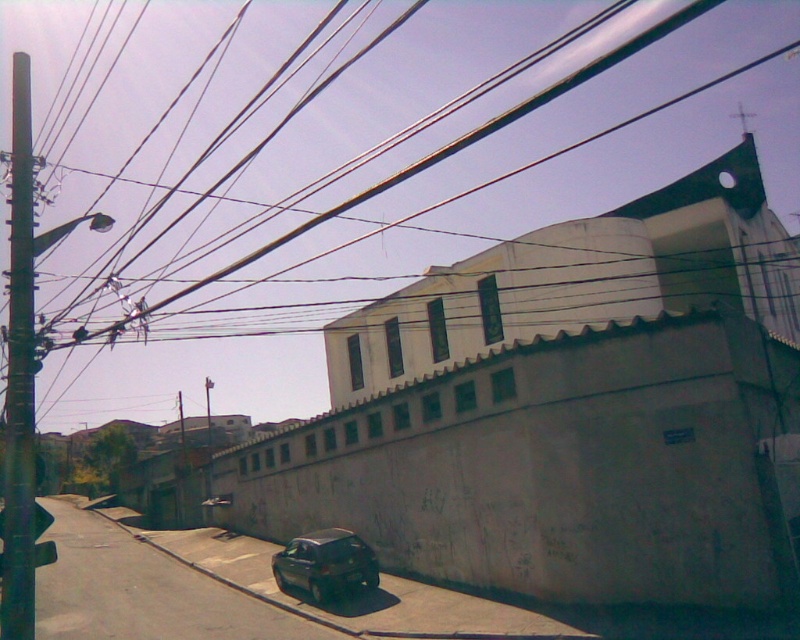
Is metallic gray pole at left closer to the viewer compared to dark gray matte car at lower center?

Yes, metallic gray pole at left is in front of dark gray matte car at lower center.

Who is taller, metallic gray pole at left or dark gray matte car at lower center?

Standing taller between the two is metallic gray pole at left.

Is point (34, 586) in front of point (334, 584)?

Yes, it is in front of point (334, 584).

You are a GUI agent. You are given a task and a screenshot of the screen. Output one action in this format:
    pyautogui.click(x=<x>, y=<y>)
    Task: Click on the metallic gray pole at left
    The image size is (800, 640).
    Given the screenshot: What is the action you would take?
    pyautogui.click(x=20, y=376)